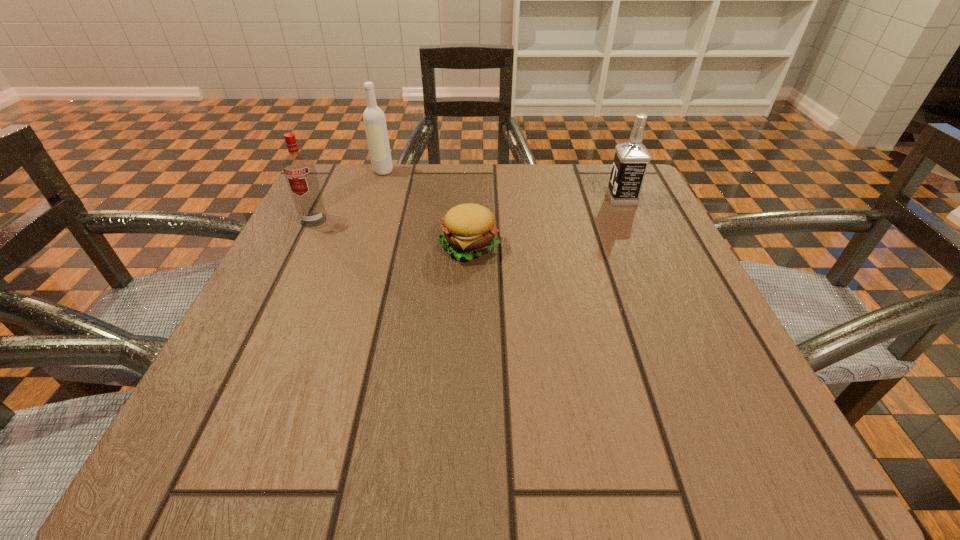
Identify the location of blank space at the far left corner of the desktop. (371, 192).

You are a GUI agent. You are given a task and a screenshot of the screen. Output one action in this format:
    pyautogui.click(x=<x>, y=<y>)
    Task: Click on the vacant space at the far right corner of the desktop
    The height and width of the screenshot is (540, 960).
    Given the screenshot: What is the action you would take?
    pyautogui.click(x=586, y=164)

Locate an element on the screen. unoccupied area between the third farthest object and the second object from left to right is located at coordinates (348, 195).

This screenshot has width=960, height=540. What are the coordinates of `free space between the nearest object and the farthest object` in the screenshot? It's located at (426, 208).

Where is `vacant point located between the second farthest vodka and the nearest object`? vacant point located between the second farthest vodka and the nearest object is located at coordinates (545, 222).

Locate an element on the screen. The image size is (960, 540). blank region between the third nearest object and the second vodka from right to left is located at coordinates (502, 185).

This screenshot has height=540, width=960. I want to click on free space between the farthest object and the shortest object, so click(426, 208).

This screenshot has width=960, height=540. What are the coordinates of `empty space between the second farthest vodka and the nearest object` in the screenshot? It's located at [545, 222].

At what (x,y) coordinates should I click in order to perform the action: click on vacant area between the third object from left to right and the farthest object. Please return your answer as a coordinate pair (x, y). The height and width of the screenshot is (540, 960). Looking at the image, I should click on (426, 208).

Image resolution: width=960 pixels, height=540 pixels. Identify the location of vacant space that's between the nearest object and the farthest object. (426, 208).